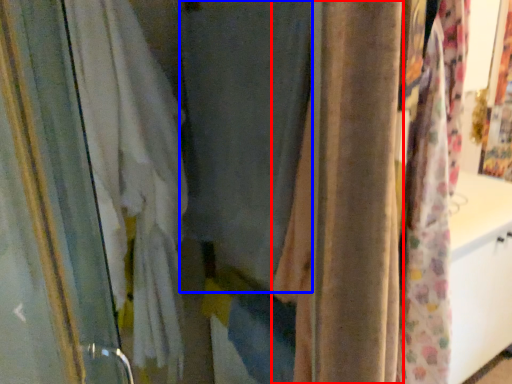
Question: Which object appears farthest to the camera in this image, curtain (highlighted by a red box) or curtain (highlighted by a blue box)?

Choices:
 (A) curtain
 (B) curtain

Answer: (B)